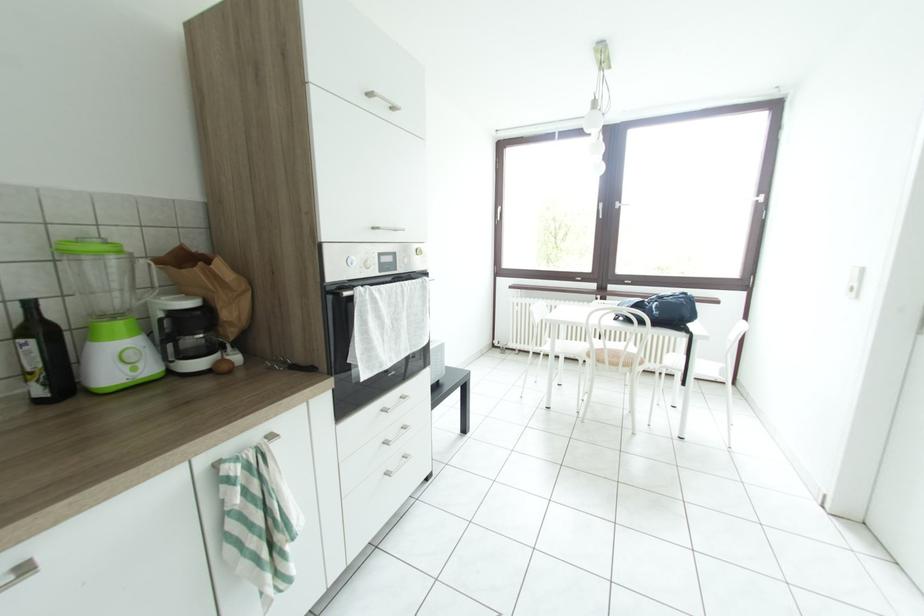
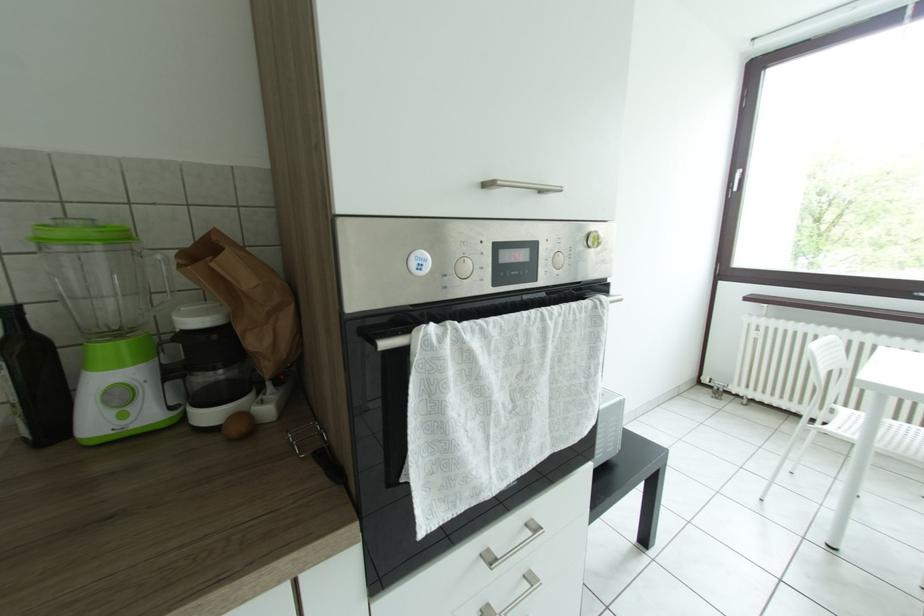
Question: The first image is from the beginning of the video and the second image is from the end. How did the camera likely rotate when shooting the video?

Choices:
 (A) Left
 (B) Right
 (C) Up
 (D) Down

Answer: (A)